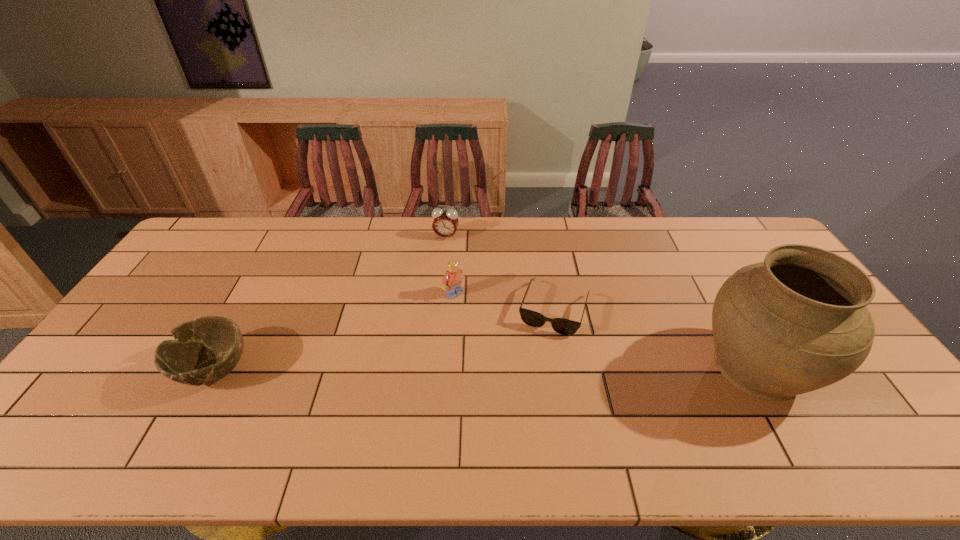
Locate an element on the screen. bowl present at the near edge is located at coordinates (204, 350).

The image size is (960, 540). What are the coordinates of `urn that is at the near edge` in the screenshot? It's located at (797, 322).

Where is `object present at the right edge`? The image size is (960, 540). object present at the right edge is located at coordinates (797, 322).

The image size is (960, 540). I want to click on object at the near right corner, so click(797, 322).

Where is `free region at the far edge of the desktop`? The image size is (960, 540). free region at the far edge of the desktop is located at coordinates (470, 224).

Identify the location of free region at the near edge of the desktop. The height and width of the screenshot is (540, 960). (353, 407).

The width and height of the screenshot is (960, 540). In the image, there is a desktop. Find the location of `vacant space at the far left corner`. vacant space at the far left corner is located at coordinates (202, 254).

Locate an element on the screen. The height and width of the screenshot is (540, 960). vacant space in between the sunglasses and the fourth tallest object is located at coordinates (384, 339).

At what (x,y) coordinates should I click in order to perform the action: click on unoccupied area between the alarm clock and the bowl. Please return your answer as a coordinate pair (x, y). The width and height of the screenshot is (960, 540). Looking at the image, I should click on (330, 303).

Image resolution: width=960 pixels, height=540 pixels. I want to click on free spot between the shortest object and the tallest object, so click(x=656, y=338).